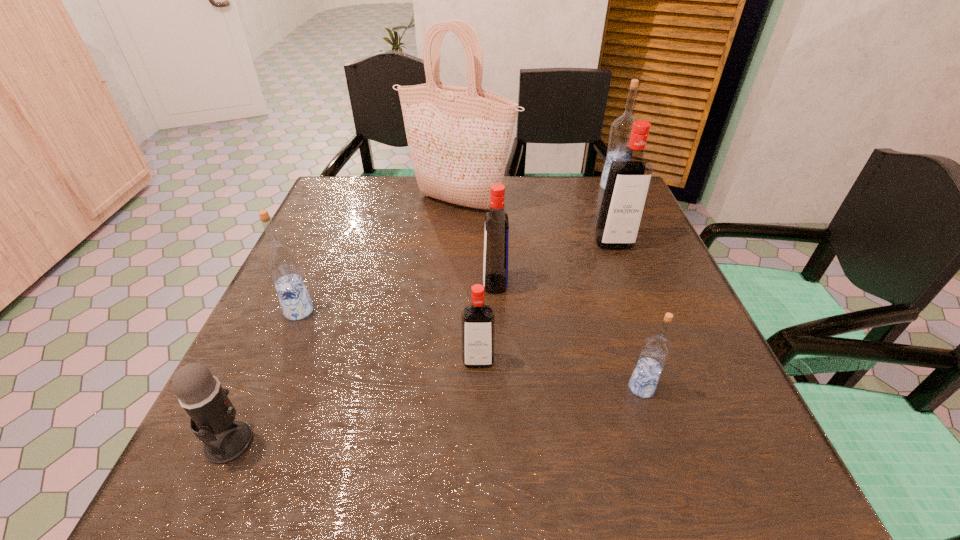
Identify which red vodka is the closest to the third nearest object. Please provide its 2D coordinates. Your answer should be formatted as a tuple, i.e. [(x, y)], where the tuple contains the x and y coordinates of a point satisfying the conditions above.

[(496, 238)]

You are a GUI agent. You are given a task and a screenshot of the screen. Output one action in this format:
    pyautogui.click(x=<x>, y=<y>)
    Task: Click on the closest red vodka to the sixth nearest object
    
    Given the screenshot: What is the action you would take?
    pyautogui.click(x=496, y=238)

Find the location of `free point that satisfies the following two spatial constraints: 1. on the front and back of the second biggest red vodka; 2. on the left side of the seventh farthest object`. free point that satisfies the following two spatial constraints: 1. on the front and back of the second biggest red vodka; 2. on the left side of the seventh farthest object is located at coordinates (499, 388).

Identify the location of free location that satisfies the following two spatial constraints: 1. on the back side of the fifth farthest object; 2. on the left side of the shopping bag. (x=346, y=202).

Image resolution: width=960 pixels, height=540 pixels. I want to click on free location that satisfies the following two spatial constraints: 1. on the front and back of the second biggest red vodka; 2. on the front side of the second smallest blue vodka, so click(496, 311).